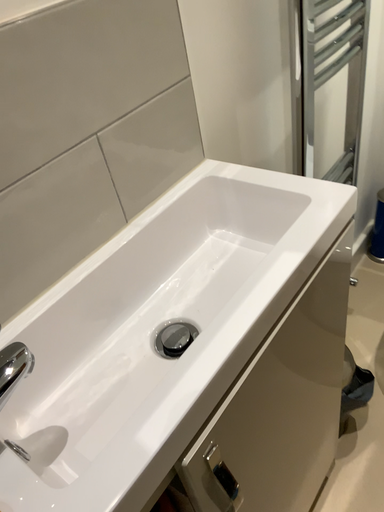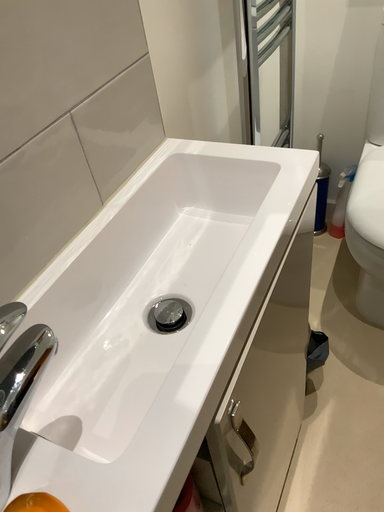
Question: How did the camera likely rotate when shooting the video?

Choices:
 (A) rotated right
 (B) rotated left

Answer: (A)